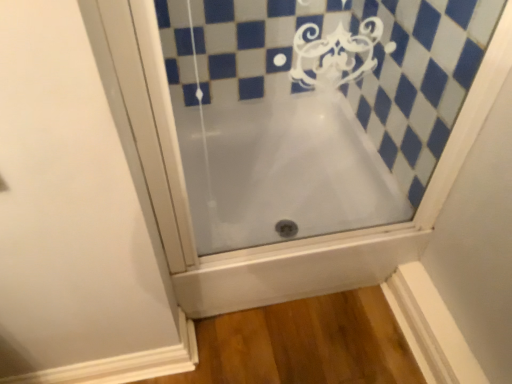
This screenshot has width=512, height=384. Identify the location of vacant space underneath white frosted glass bathtub at center (from a real-world perspective). coord(315,255).